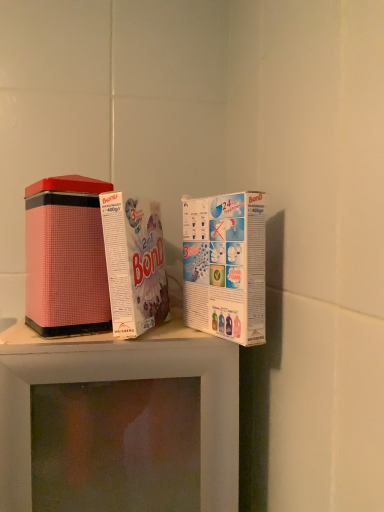
Question: Is white cardboard box at upper right, which is counted as the 3th product, starting from the left, at the left side of pink matte tin at center, the 2th product when ordered from left to right?

Choices:
 (A) no
 (B) yes

Answer: (A)

Question: Is white cardboard box at upper right, placed as the 1th product when sorted from right to left, surrounding pink matte tin at center, the 2th product when ordered from left to right?

Choices:
 (A) yes
 (B) no

Answer: (B)

Question: Is white cardboard box at upper right, placed as the 1th product when sorted from right to left, wider than pink matte tin at center, the second product from the right?

Choices:
 (A) no
 (B) yes

Answer: (A)

Question: Considering the relative sizes of white cardboard box at upper right, which is counted as the 3th product, starting from the left, and pink matte tin at center, the second product from the right, in the image provided, is white cardboard box at upper right, which is counted as the 3th product, starting from the left, thinner than pink matte tin at center, the second product from the right,?

Choices:
 (A) no
 (B) yes

Answer: (B)

Question: From a real-world perspective, is white cardboard box at upper right, placed as the 1th product when sorted from right to left, physically above pink matte tin at center, the second product from the right?

Choices:
 (A) no
 (B) yes

Answer: (A)

Question: From a real-world perspective, is pink matte tin at center, the second product from the right, above or below pink matte tin can at left, positioned as the 1th product in left-to-right order?

Choices:
 (A) above
 (B) below

Answer: (A)

Question: Based on their positions, is pink matte tin at center, the 2th product when ordered from left to right, located to the left or right of pink matte tin can at left, which is counted as the 3th product, starting from the right?

Choices:
 (A) left
 (B) right

Answer: (B)

Question: Is pink matte tin at center, the second product from the right, bigger or smaller than pink matte tin can at left, which is counted as the 3th product, starting from the right?

Choices:
 (A) big
 (B) small

Answer: (B)

Question: In the image, is pink matte tin at center, the 2th product when ordered from left to right, positioned in front of or behind pink matte tin can at left, which is counted as the 3th product, starting from the right?

Choices:
 (A) behind
 (B) front

Answer: (B)

Question: Does point (127, 270) appear closer or farther from the camera than point (248, 199)?

Choices:
 (A) closer
 (B) farther

Answer: (B)

Question: Is pink matte tin at center, the second product from the right, inside the boundaries of white cardboard box at upper right, which is counted as the 3th product, starting from the left, or outside?

Choices:
 (A) inside
 (B) outside

Answer: (B)

Question: From a real-world perspective, is pink matte tin at center, the second product from the right, positioned above or below white cardboard box at upper right, which is counted as the 3th product, starting from the left?

Choices:
 (A) below
 (B) above

Answer: (B)

Question: In terms of height, does pink matte tin at center, the second product from the right, look taller or shorter compared to white cardboard box at upper right, placed as the 1th product when sorted from right to left?

Choices:
 (A) short
 (B) tall

Answer: (B)

Question: Looking at the image, does white cardboard box at upper right, which is counted as the 3th product, starting from the left, seem bigger or smaller compared to pink matte tin at center, the second product from the right?

Choices:
 (A) small
 (B) big

Answer: (A)

Question: From a real-world perspective, is white cardboard box at upper right, which is counted as the 3th product, starting from the left, physically located above or below pink matte tin at center, the 2th product when ordered from left to right?

Choices:
 (A) above
 (B) below

Answer: (B)